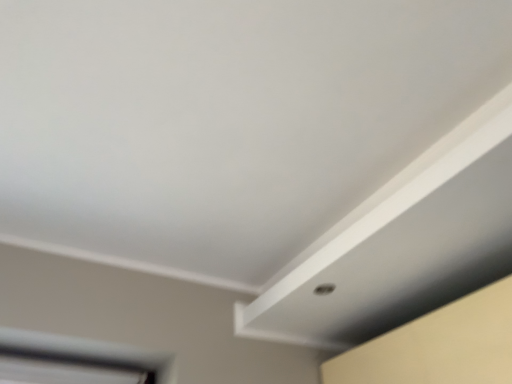
What is the approximate width of white matte exhaust hood at center?

white matte exhaust hood at center is 52.30 centimeters wide.

Describe the element at coordinates (401, 244) in the screenshot. I see `white matte exhaust hood at center` at that location.

Where is `white matte exhaust hood at center`? white matte exhaust hood at center is located at coordinates (401, 244).

I want to click on white plastic window at lower left, so click(x=77, y=361).

This screenshot has height=384, width=512. What do you see at coordinates (77, 361) in the screenshot?
I see `white plastic window at lower left` at bounding box center [77, 361].

Identify the location of white matte exhaust hood at center. (401, 244).

Visually, is white matte exhaust hood at center positioned to the left or to the right of white plastic window at lower left?

In the image, white matte exhaust hood at center appears on the right side of white plastic window at lower left.

In the image, is white matte exhaust hood at center positioned in front of or behind white plastic window at lower left?

white matte exhaust hood at center is in front of white plastic window at lower left.

Does point (324, 242) come farther from viewer compared to point (100, 353)?

Yes.

From the image's perspective, is white matte exhaust hood at center under white plastic window at lower left?

No, from the image's perspective, white matte exhaust hood at center is not beneath white plastic window at lower left.

From a real-world perspective, is white matte exhaust hood at center physically below white plastic window at lower left?

No, from a real-world perspective, white matte exhaust hood at center is not below white plastic window at lower left.

Between white matte exhaust hood at center and white plastic window at lower left, which one has smaller width?

white plastic window at lower left.

Is white matte exhaust hood at center taller or shorter than white plastic window at lower left?

Considering their sizes, white matte exhaust hood at center has more height than white plastic window at lower left.

Considering the sizes of objects white matte exhaust hood at center and white plastic window at lower left in the image provided, who is bigger, white matte exhaust hood at center or white plastic window at lower left?

white matte exhaust hood at center is bigger.

From the picture: Is white matte exhaust hood at center positioned beyond the bounds of white plastic window at lower left?

Yes.

Is white matte exhaust hood at center next to white plastic window at lower left?

No.

Is white matte exhaust hood at center aimed at white plastic window at lower left?

No, white matte exhaust hood at center is not aimed at white plastic window at lower left.

Where is `exhaust hood positioned vertically above the white plastic window at lower left (from a real-world perspective)`? This screenshot has height=384, width=512. exhaust hood positioned vertically above the white plastic window at lower left (from a real-world perspective) is located at coordinates (401, 244).

Does white plastic window at lower left appear on the right side of white matte exhaust hood at center?

No, white plastic window at lower left is not to the right of white matte exhaust hood at center.

Between white plastic window at lower left and white matte exhaust hood at center, which one is positioned behind?

white plastic window at lower left is further away from the camera.

Is point (170, 382) less distant than point (394, 210)?

That is False.

From the image's perspective, is white plastic window at lower left under white matte exhaust hood at center?

Correct, white plastic window at lower left appears lower than white matte exhaust hood at center in the image.

From a real-world perspective, is white plastic window at lower left positioned above or below white matte exhaust hood at center?

white plastic window at lower left is below white matte exhaust hood at center.

Between white plastic window at lower left and white matte exhaust hood at center, which one has smaller width?

With smaller width is white plastic window at lower left.

Which of these two, white plastic window at lower left or white matte exhaust hood at center, stands shorter?

white plastic window at lower left is shorter.

Which of these two, white plastic window at lower left or white matte exhaust hood at center, is smaller?

With smaller size is white plastic window at lower left.

Which is correct: white plastic window at lower left is inside white matte exhaust hood at center, or outside of it?

white plastic window at lower left is spatially situated outside white matte exhaust hood at center.

Is white plastic window at lower left directly adjacent to white matte exhaust hood at center?

No, white plastic window at lower left is not with white matte exhaust hood at center.

Is white plastic window at lower left facing away from white matte exhaust hood at center?

white plastic window at lower left does not have its back to white matte exhaust hood at center.

How far apart are white plastic window at lower left and white matte exhaust hood at center?

28.14 inches.

Locate an element on the screen. This screenshot has height=384, width=512. window behind the white matte exhaust hood at center is located at coordinates (77, 361).

This screenshot has width=512, height=384. What are the coordinates of `exhaust hood on the right of white plastic window at lower left` in the screenshot? It's located at (401, 244).

I want to click on exhaust hood above the white plastic window at lower left (from a real-world perspective), so click(401, 244).